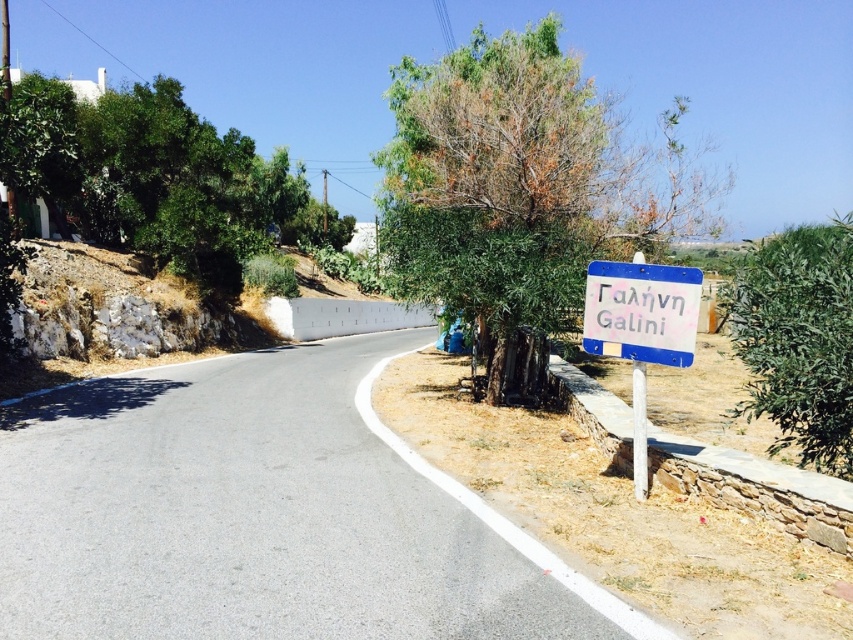
You are a pedestrian standing at the start of the road and want to reach a destination located at point (659,314). There is an obstacle at point (576,93) blocking your path. Can you walk straight ahead without detouring around the obstacle?

Point (576,93) is closer to you than point (659,314), so the obstacle is in front of your path. You must detour around the obstacle to reach your destination.

You are driving along the road and see the green leafy tree at center right and the blue plastic sign at right. Which object is positioned more to the right side of the road?

The green leafy tree at center right is positioned more to the right side of the road than the blue plastic sign at right.